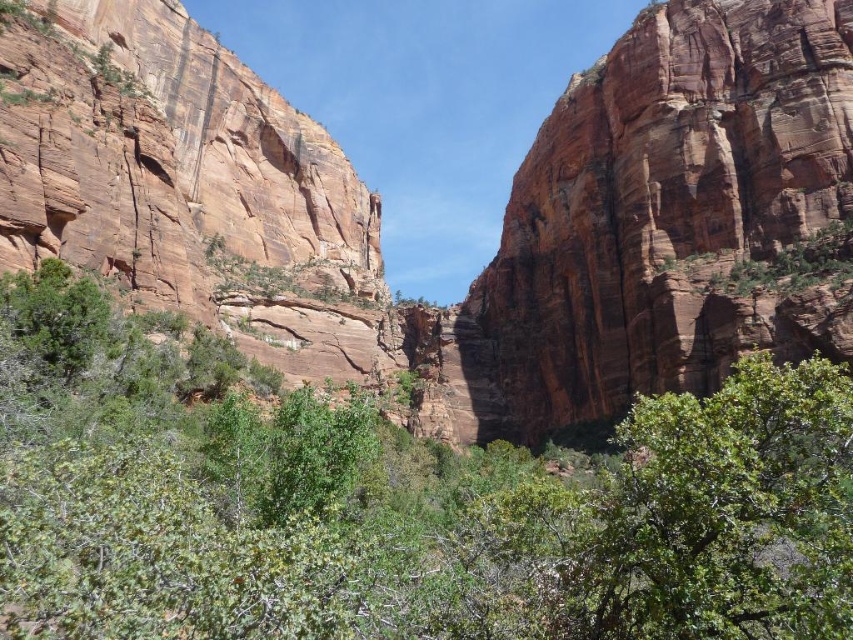
You are standing at the edge of the canyon and see the green leafy shrubs at center and the rustic sandstone cliff at center. Which object is closer to your current position?

The green leafy shrubs at center are closer to your current position because they are located below the rustic sandstone cliff at center, which means the shrubs are in the foreground while the cliff is further back.

Based on the provided scene description, where exactly is the green leafy shrubs at center located in terms of its 2D coordinates?

The green leafy shrubs at center are located at the 2D coordinates point [393,502].